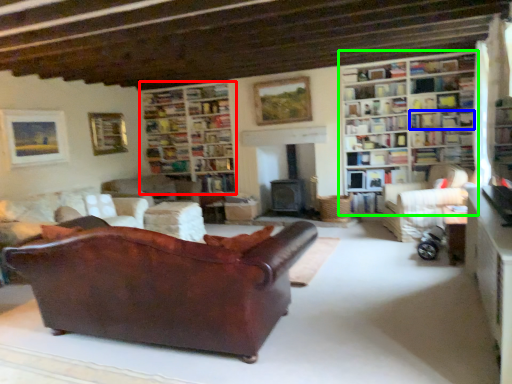
Question: Which object is the farthest from bookcase (highlighted by a red box)? Choose among these: shelf (highlighted by a blue box) or bookcase (highlighted by a green box).

Choices:
 (A) shelf
 (B) bookcase

Answer: (A)